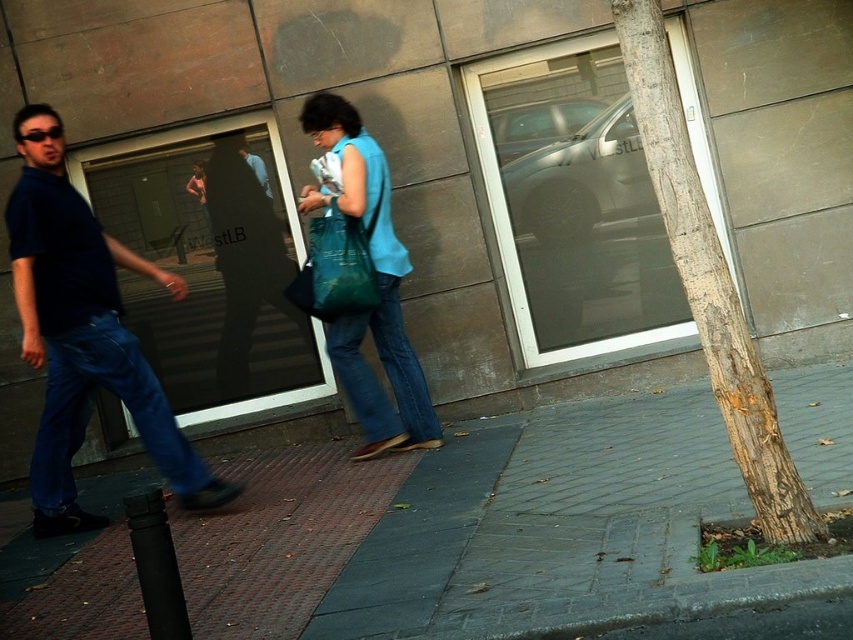
Question: Can you confirm if brown textured bark at right is positioned above matte green fabric bag at center?

Choices:
 (A) yes
 (B) no

Answer: (B)

Question: Which point appears farthest from the camera in this image?

Choices:
 (A) (62, 291)
 (B) (375, 305)
 (C) (315, 260)
 (D) (228, 241)

Answer: (D)

Question: Is the position of blue denim jeans at left more distant than that of matte green fabric bag at center?

Choices:
 (A) no
 (B) yes

Answer: (A)

Question: Does matte blue fabric bag at center have a larger size compared to blue denim jeans at left?

Choices:
 (A) no
 (B) yes

Answer: (B)

Question: Which of the following is the closest to the observer?

Choices:
 (A) matte blue fabric bag at center
 (B) denim at center
 (C) smooth concrete sidewalk at center
 (D) matte green fabric bag at center

Answer: (C)

Question: Estimate the real-world distances between objects in this image. Which object is farther from the denim at center?

Choices:
 (A) blue denim jeans at left
 (B) smooth concrete sidewalk at center
 (C) matte blue fabric bag at center
 (D) brown textured bark at right

Answer: (D)